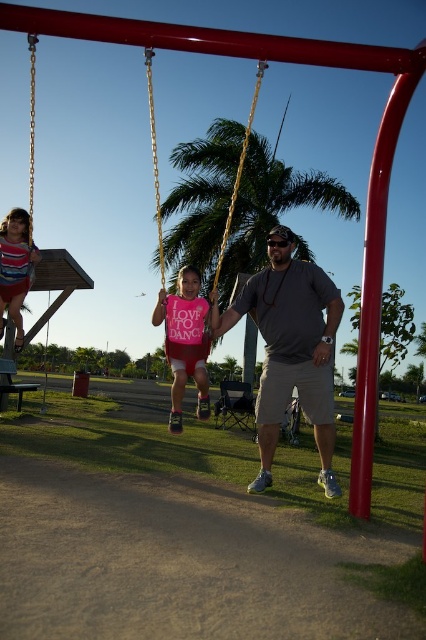
You are a photographer trying to capture a photo of the gray cotton shirt at center and the green leafy palm tree at center. From your current position, which object is more to the left?

The green leafy palm tree at center is more to the left than the gray cotton shirt at center.

You are a photographer trying to capture a photo of both the green leafy palm tree at center and the striped fabric dress at left. Based on their positions, which object should you focus on first to ensure both are in frame?

The striped fabric dress at left should be focused on first since the green leafy palm tree at center is positioned to its right, allowing both to be captured in the frame by starting with the leftmost object.

You are standing at the point marked by the coordinates point (273, 208) in the playground scene. Looking around, you see a red swing set structure on the right side of the frame. Which direction should you face to see the red swing set structure?

The red swing set structure is on the right side of the frame, so if you are standing at point (273, 208), you should face to your right to see it.